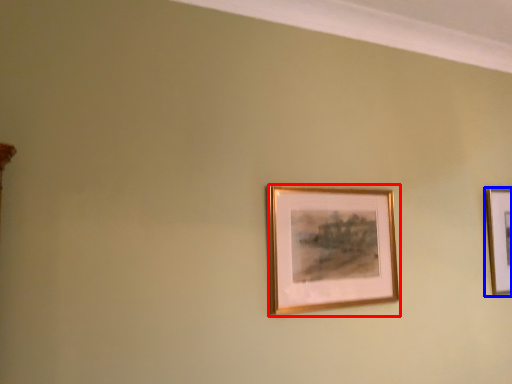
Question: Among these objects, which one is farthest to the camera, picture frame (highlighted by a red box) or picture frame (highlighted by a blue box)?

Choices:
 (A) picture frame
 (B) picture frame

Answer: (B)